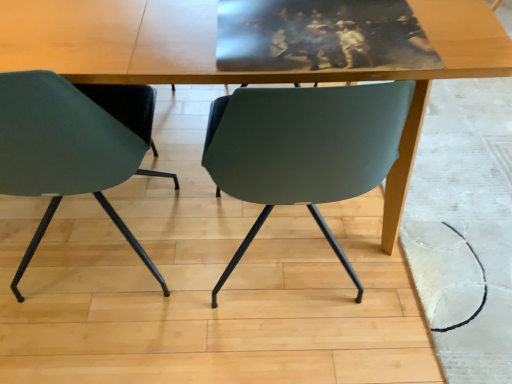
This screenshot has height=384, width=512. I want to click on wooden table at center, so click(x=234, y=72).

This screenshot has width=512, height=384. Describe the element at coordinates (234, 72) in the screenshot. I see `wooden table at center` at that location.

What is the approximate height of wooden table at center?

30.77 inches.

What do you see at coordinates (73, 145) in the screenshot? I see `matte green chair at left` at bounding box center [73, 145].

Measure the distance between matte green chair at left and camera.

matte green chair at left is 26.69 inches from camera.

Locate an element on the screen. matte green chair at left is located at coordinates (73, 145).

You are a GUI agent. You are given a task and a screenshot of the screen. Output one action in this format:
    pyautogui.click(x=<x>, y=<y>)
    Task: Click on the wooden table at center
    The width and height of the screenshot is (512, 384).
    Given the screenshot: What is the action you would take?
    pyautogui.click(x=234, y=72)

Consider the image. In the image, is wooden table at center on the left side or the right side of matte green chair at left?

In the image, wooden table at center appears on the right side of matte green chair at left.

Which object is closer to the camera taking this photo, wooden table at center or matte green chair at left?

matte green chair at left is in front.

Between point (144, 63) and point (90, 95), which one is positioned behind?

The point (90, 95) is behind.

From the image's perspective, is wooden table at center positioned above or below matte green chair at left?

wooden table at center is above matte green chair at left.

From a real-world perspective, relative to matte green chair at left, is wooden table at center vertically above or below?

wooden table at center is situated lower than matte green chair at left in the real world.

Which of these two, wooden table at center or matte green chair at left, is wider?

With larger width is wooden table at center.

Is wooden table at center taller or shorter than matte green chair at left?

In the image, wooden table at center appears to be shorter than matte green chair at left.

Is wooden table at center bigger than matte green chair at left?

Correct, wooden table at center is larger in size than matte green chair at left.

Can matte green chair at left be found inside wooden table at center?

Indeed, matte green chair at left is located within wooden table at center.

Is wooden table at center touching matte green chair at left?

No, wooden table at center is not beside matte green chair at left.

Is matte green chair at left at the back of wooden table at center?

Yes, matte green chair at left is at the back of wooden table at center.

Can you tell me how much wooden table at center and matte green chair at left differ in facing direction?

They differ by 1.72 degrees in their facing directions.

At what (x,y) coordinates should I click in order to perform the action: click on chair on the left of wooden table at center. Please return your answer as a coordinate pair (x, y). This screenshot has height=384, width=512. Looking at the image, I should click on (73, 145).

Which is more to the right, matte green chair at left or wooden table at center?

wooden table at center.

Considering their positions, is matte green chair at left located in front of or behind wooden table at center?

Visually, matte green chair at left is located in front of wooden table at center.

Does point (76, 184) appear closer or farther from the camera than point (131, 20)?

Point (76, 184) is positioned farther from the camera compared to point (131, 20).

In the scene shown: From the image's perspective, is matte green chair at left located above or below wooden table at center?

Clearly, from the image's perspective, matte green chair at left is below wooden table at center.

From a real-world perspective, which is physically below, matte green chair at left or wooden table at center?

In real-world perspective, wooden table at center is lower.

In terms of width, does matte green chair at left look wider or thinner when compared to wooden table at center?

Clearly, matte green chair at left has less width compared to wooden table at center.

Considering the sizes of objects matte green chair at left and wooden table at center in the image provided, who is shorter, matte green chair at left or wooden table at center?

Standing shorter between the two is wooden table at center.

Who is smaller, matte green chair at left or wooden table at center?

Smaller between the two is matte green chair at left.

Is matte green chair at left not inside wooden table at center?

No, matte green chair at left is inside wooden table at center's boundary.

Would you consider matte green chair at left to be distant from wooden table at center?

No, matte green chair at left is not far from wooden table at center.

Is matte green chair at left oriented away from wooden table at center?

That's right, matte green chair at left is facing away from wooden table at center.

How different are the orientations of matte green chair at left and wooden table at center in degrees?

1.72 degrees.

The width and height of the screenshot is (512, 384). I want to click on chair below the wooden table at center (from the image's perspective), so click(x=73, y=145).

Find the location of a particular element. table behind the matte green chair at left is located at coordinates (234, 72).

Identify the location of table below the matte green chair at left (from a real-world perspective). The width and height of the screenshot is (512, 384). (234, 72).